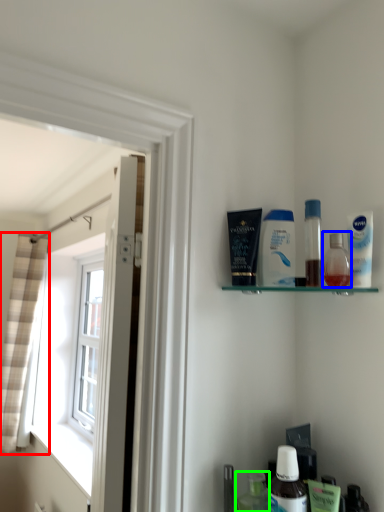
Question: Estimate the real-world distances between objects in this image. Which object is farther from curtain (highlighted by a red box), toiletry (highlighted by a blue box) or toiletry (highlighted by a green box)?

Choices:
 (A) toiletry
 (B) toiletry

Answer: (A)